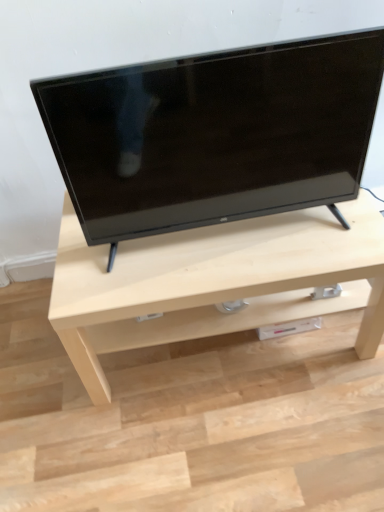
Question: From the image's perspective, is light wood table at center on black glossy tv at center?

Choices:
 (A) yes
 (B) no

Answer: (B)

Question: Is light wood table at center smaller than black glossy tv at center?

Choices:
 (A) no
 (B) yes

Answer: (A)

Question: Does light wood table at center appear on the left side of black glossy tv at center?

Choices:
 (A) yes
 (B) no

Answer: (B)

Question: Is light wood table at center wider than black glossy tv at center?

Choices:
 (A) no
 (B) yes

Answer: (B)

Question: Does light wood table at center come behind black glossy tv at center?

Choices:
 (A) yes
 (B) no

Answer: (A)

Question: Does light wood table at center appear on the right side of black glossy tv at center?

Choices:
 (A) yes
 (B) no

Answer: (A)

Question: Is light wood table at center inside black glossy tv at center?

Choices:
 (A) no
 (B) yes

Answer: (A)

Question: From a real-world perspective, is black glossy tv at center over light wood table at center?

Choices:
 (A) no
 (B) yes

Answer: (B)

Question: Is black glossy tv at center directly adjacent to light wood table at center?

Choices:
 (A) yes
 (B) no

Answer: (B)

Question: Does black glossy tv at center appear on the right side of light wood table at center?

Choices:
 (A) yes
 (B) no

Answer: (B)

Question: From the image's perspective, is black glossy tv at center beneath light wood table at center?

Choices:
 (A) yes
 (B) no

Answer: (B)

Question: Are black glossy tv at center and light wood table at center located far from each other?

Choices:
 (A) yes
 (B) no

Answer: (B)

Question: Is black glossy tv at center in front of or behind light wood table at center in the image?

Choices:
 (A) behind
 (B) front

Answer: (B)